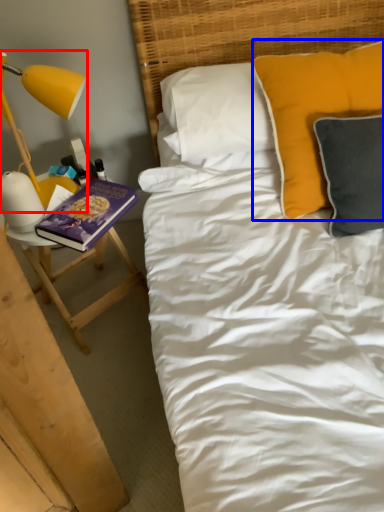
Question: Which of the following is the farthest to the observer, lamp (highlighted by a red box) or pillow (highlighted by a blue box)?

Choices:
 (A) lamp
 (B) pillow

Answer: (A)